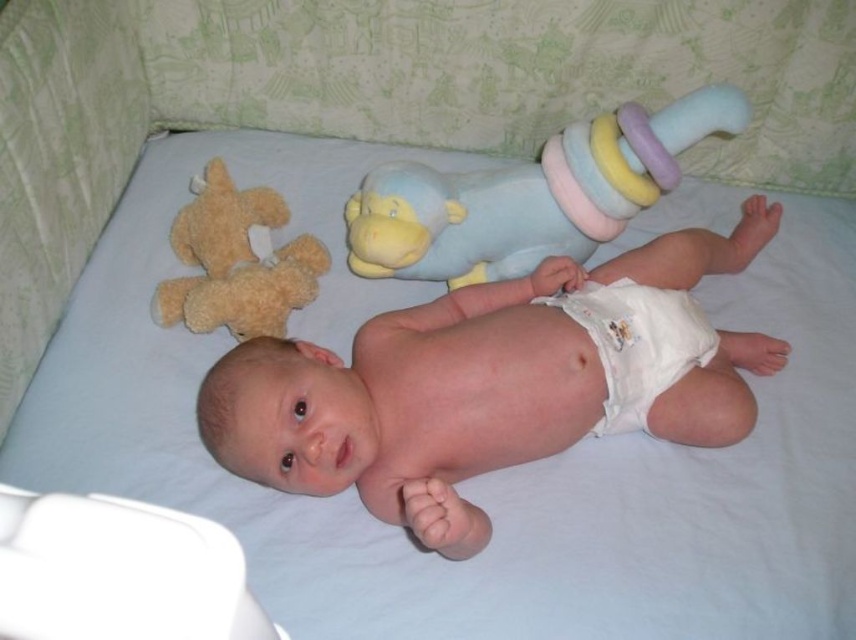
Question: Is pastel plush monkey at upper center below white cloth diaper at center?

Choices:
 (A) no
 (B) yes

Answer: (A)

Question: Is pastel plush monkey at upper center thinner than white cloth diaper at center?

Choices:
 (A) yes
 (B) no

Answer: (B)

Question: Which of the following is the closest to the observer?

Choices:
 (A) soft brown teddy bear at upper left
 (B) pastel plush monkey at upper center

Answer: (A)

Question: Observing the image, what is the correct spatial positioning of pink cloth diaper at center in reference to soft brown teddy bear at upper left?

Choices:
 (A) right
 (B) left

Answer: (A)

Question: Which point is closer to the camera?

Choices:
 (A) pastel plush monkey at upper center
 (B) pink cloth diaper at center
 (C) white cloth diaper at center
 (D) soft brown teddy bear at upper left

Answer: (B)

Question: Based on their relative distances, which object is farther from the pink cloth diaper at center?

Choices:
 (A) white cloth diaper at center
 (B) pastel plush monkey at upper center

Answer: (B)